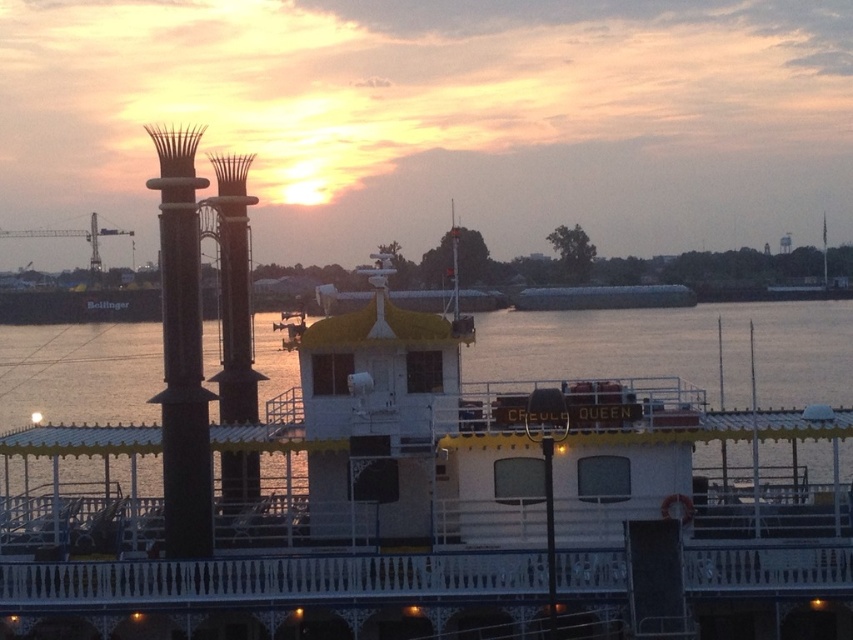
Can you confirm if white wooden river at center is positioned above brown wood pillar at center?

No.

Is point (503, 369) farther from camera compared to point (225, 193)?

That is True.

The width and height of the screenshot is (853, 640). Identify the location of white wooden river at center. (679, 348).

How distant is polished brass column at center from brown wood pillar at center?

polished brass column at center is 5.50 meters from brown wood pillar at center.

Does polished brass column at center have a greater width compared to brown wood pillar at center?

Incorrect, polished brass column at center's width does not surpass brown wood pillar at center's.

Which is in front, point (194, 464) or point (219, 257)?

Positioned in front is point (194, 464).

The width and height of the screenshot is (853, 640). Find the location of `polished brass column at center`. polished brass column at center is located at coordinates (183, 349).

Does white wooden boat at center have a smaller size compared to white wooden river at center?

Yes, white wooden boat at center is smaller than white wooden river at center.

Image resolution: width=853 pixels, height=640 pixels. What do you see at coordinates (439, 508) in the screenshot?
I see `white wooden boat at center` at bounding box center [439, 508].

Locate an element on the screen. white wooden boat at center is located at coordinates (439, 508).